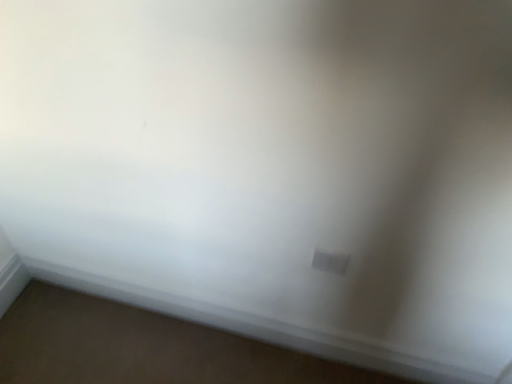
Question: Choose the correct answer: Is white smooth baseboard at lower center inside white plastic electric outlet at lower right or outside it?

Choices:
 (A) outside
 (B) inside

Answer: (A)

Question: In the image, is white smooth baseboard at lower center positioned in front of or behind white plastic electric outlet at lower right?

Choices:
 (A) front
 (B) behind

Answer: (B)

Question: In terms of width, does white smooth baseboard at lower center look wider or thinner when compared to white plastic electric outlet at lower right?

Choices:
 (A) wide
 (B) thin

Answer: (A)

Question: Would you say white plastic electric outlet at lower right is to the left or to the right of white smooth baseboard at lower center in the picture?

Choices:
 (A) right
 (B) left

Answer: (A)

Question: Looking at their shapes, would you say white plastic electric outlet at lower right is wider or thinner than white smooth baseboard at lower center?

Choices:
 (A) thin
 (B) wide

Answer: (A)

Question: Is white plastic electric outlet at lower right taller or shorter than white smooth baseboard at lower center?

Choices:
 (A) tall
 (B) short

Answer: (B)

Question: In terms of size, does white plastic electric outlet at lower right appear bigger or smaller than white smooth baseboard at lower center?

Choices:
 (A) small
 (B) big

Answer: (A)